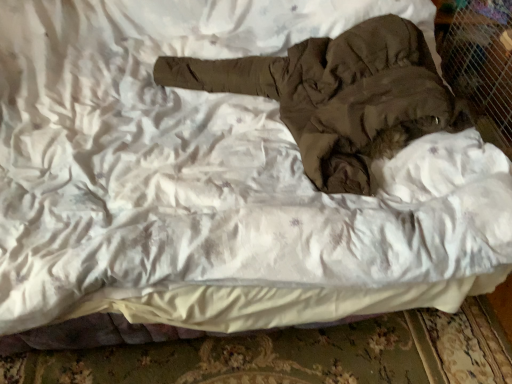
What is the approximate width of brown cotton jacket at center?

60.40 centimeters.

Where is `brown cotton jacket at center`? This screenshot has width=512, height=384. brown cotton jacket at center is located at coordinates (339, 96).

Describe the element at coordinates (339, 96) in the screenshot. I see `brown cotton jacket at center` at that location.

Measure the distance between brown cotton jacket at center and camera.

They are 1.10 meters apart.

Image resolution: width=512 pixels, height=384 pixels. Identify the location of brown cotton jacket at center. (339, 96).